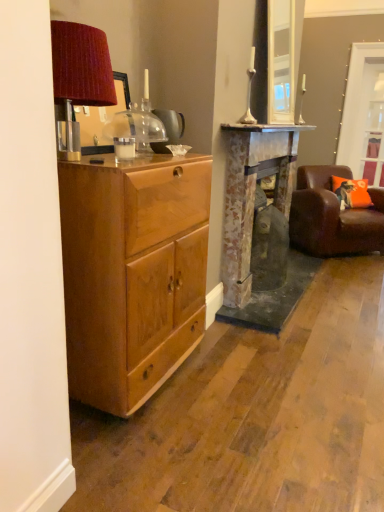
Find the location of a particular element. This screenshot has width=384, height=512. orange fabric pillow at right is located at coordinates (351, 193).

Measure the distance between point (116, 286) and camera.

They are 5.24 feet apart.

At what (x,y) coordinates should I click in order to perform the action: click on matte wood cabinet at left. Please return your answer as a coordinate pair (x, y). This screenshot has width=384, height=512. Looking at the image, I should click on (132, 273).

This screenshot has height=512, width=384. I want to click on brown leather chair at right, so click(x=332, y=216).

From a real-world perspective, does clear glass door at upper right sit lower than brown leather chair at right?

No, from a real-world perspective, clear glass door at upper right is not under brown leather chair at right.

Can we say clear glass door at upper right lies outside brown leather chair at right?

That's correct, clear glass door at upper right is outside of brown leather chair at right.

From the picture: How different are the orientations of clear glass door at upper right and brown leather chair at right in degrees?

The angular difference between clear glass door at upper right and brown leather chair at right is 44.5 degrees.

Are clear glass door at upper right and brown leather chair at right beside each other?

No, clear glass door at upper right is not touching brown leather chair at right.

Is orange fabric pillow at right thinner than matte wood cabinet at left?

Yes.

Does point (367, 186) come closer to viewer compared to point (132, 260)?

No.

Is orange fabric pillow at right positioned with its back to matte wood cabinet at left?

No.

Which object is closer to the camera, orange fabric pillow at right or matte wood cabinet at left?

Positioned in front is matte wood cabinet at left.

The height and width of the screenshot is (512, 384). In order to click on chair that appears on the right of matte wood cabinet at left in this screenshot , I will do `click(332, 216)`.

From a real-world perspective, who is located higher, matte wood cabinet at left or brown leather chair at right?

In real-world perspective, matte wood cabinet at left is above.

Based on their sizes in the image, would you say matte wood cabinet at left is bigger or smaller than brown leather chair at right?

Considering their sizes, matte wood cabinet at left takes up less space than brown leather chair at right.

Which object is closer to the camera taking this photo, matte wood cabinet at left or brown leather chair at right?

matte wood cabinet at left is in front.

Is rustic stone fireplace at center next to matte wood cabinet at left and touching it?

No, rustic stone fireplace at center is not making contact with matte wood cabinet at left.

Which is correct: rustic stone fireplace at center is inside matte wood cabinet at left, or outside of it?

The correct answer is: outside.

From a real-world perspective, does rustic stone fireplace at center stand above matte wood cabinet at left?

Yes, from a real-world perspective, rustic stone fireplace at center is over matte wood cabinet at left

Is rustic stone fireplace at center wider or thinner than matte wood cabinet at left?

Considering their sizes, rustic stone fireplace at center looks slimmer than matte wood cabinet at left.

Can you confirm if clear glass door at upper right is smaller than matte wood cabinet at left?

Indeed, clear glass door at upper right has a smaller size compared to matte wood cabinet at left.

Is clear glass door at upper right shorter than matte wood cabinet at left?

In fact, clear glass door at upper right may be taller than matte wood cabinet at left.

Consider the image. Is clear glass door at upper right inside the boundaries of matte wood cabinet at left, or outside?

clear glass door at upper right is not enclosed by matte wood cabinet at left.

Where is `glass door behind the matte wood cabinet at left`? glass door behind the matte wood cabinet at left is located at coordinates (373, 131).

Between point (241, 219) and point (381, 208), which one is positioned in front?

Positioned in front is point (241, 219).

From their relative heights in the image, would you say rustic stone fireplace at center is taller or shorter than brown leather chair at right?

rustic stone fireplace at center is taller than brown leather chair at right.

Could you tell me if rustic stone fireplace at center is turned towards brown leather chair at right?

No, rustic stone fireplace at center is not turned towards brown leather chair at right.

Can you confirm if rustic stone fireplace at center is thinner than brown leather chair at right?

Indeed, rustic stone fireplace at center has a lesser width compared to brown leather chair at right.

Which of these two, clear glass door at upper right or orange fabric pillow at right, is smaller?

With smaller size is clear glass door at upper right.

Is clear glass door at upper right turned away from orange fabric pillow at right?

clear glass door at upper right is not turned away from orange fabric pillow at right.

Which point is more distant from viewer, (379, 75) or (340, 191)?

The point (379, 75) is behind.

Is clear glass door at upper right closer to the viewer compared to orange fabric pillow at right?

No, clear glass door at upper right is behind orange fabric pillow at right.

In order to click on glass door behind the brown leather chair at right in this screenshot , I will do `click(373, 131)`.

Locate an element on the screen. Image resolution: width=384 pixels, height=512 pixels. pillow above the matte wood cabinet at left (from a real-world perspective) is located at coordinates (351, 193).

Which object lies nearer to the anchor point clear glass door at upper right, brown leather chair at right or matte wood cabinet at left?

brown leather chair at right lies closer to clear glass door at upper right than the other object.

Based on their spatial positions, is rustic stone fireplace at center or brown leather chair at right further from orange fabric pillow at right?

rustic stone fireplace at center is further to orange fabric pillow at right.

Looking at the image, which one is located further to brown leather chair at right, matte wood cabinet at left or orange fabric pillow at right?

matte wood cabinet at left lies further to brown leather chair at right than the other object.

Which object lies further to the anchor point orange fabric pillow at right, clear glass door at upper right or rustic stone fireplace at center?

rustic stone fireplace at center lies further to orange fabric pillow at right than the other object.

From the image, which object appears to be nearer to rustic stone fireplace at center, matte wood cabinet at left or brown leather chair at right?

brown leather chair at right is closer to rustic stone fireplace at center.

From the picture: When comparing their distances from matte wood cabinet at left, does rustic stone fireplace at center or brown leather chair at right seem further?

brown leather chair at right.

Estimate the real-world distances between objects in this image. Which object is further from matte wood cabinet at left, brown leather chair at right or clear glass door at upper right?

clear glass door at upper right is positioned further to the anchor matte wood cabinet at left.

When comparing their distances from brown leather chair at right, does rustic stone fireplace at center or orange fabric pillow at right seem closer?

orange fabric pillow at right is closer to brown leather chair at right.

At what (x,y) coordinates should I click in order to perform the action: click on fireplace between matte wood cabinet at left and brown leather chair at right from front to back. Please return your answer as a coordinate pair (x, y). The width and height of the screenshot is (384, 512). Looking at the image, I should click on (261, 229).

This screenshot has height=512, width=384. I want to click on chair between rustic stone fireplace at center and clear glass door at upper right from front to back, so click(x=332, y=216).

You are a GUI agent. You are given a task and a screenshot of the screen. Output one action in this format:
    pyautogui.click(x=<x>, y=<y>)
    Task: Click on the fireplace between matte wood cabinet at left and clear glass door at upper right along the z-axis
    Image resolution: width=384 pixels, height=512 pixels.
    Given the screenshot: What is the action you would take?
    pyautogui.click(x=261, y=229)

I want to click on pillow between rustic stone fireplace at center and clear glass door at upper right from front to back, so click(351, 193).